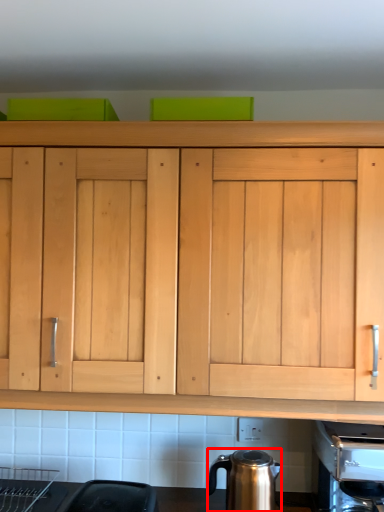
Question: From the image's perspective, considering the relative positions of kitchen appliance (annotated by the red box) and coffee machine in the image provided, where is kitchen appliance (annotated by the red box) located with respect to the staircase?

Choices:
 (A) below
 (B) above

Answer: (A)